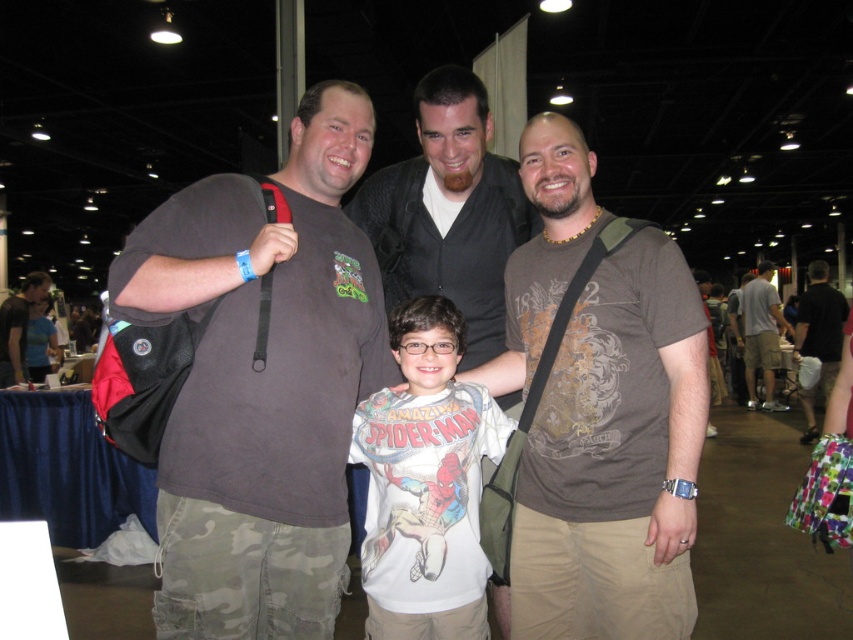
Question: Among these points, which one is nearest to the camera?

Choices:
 (A) click(x=9, y=348)
 (B) click(x=264, y=563)
 (C) click(x=368, y=612)

Answer: (B)

Question: Which object is positioned farthest from the dark brown leather jacket at center?

Choices:
 (A) brown cotton t-shirt at center
 (B) light brown cotton t-shirt at center
 (C) white cotton t-shirt at center
 (D) dark gray t-shirt at left

Answer: (B)

Question: Is dark gray t-shirt at left smaller than white cotton t-shirt at center?

Choices:
 (A) no
 (B) yes

Answer: (A)

Question: Among these points, which one is farthest from the camera?

Choices:
 (A) (770, 275)
 (B) (15, 365)

Answer: (A)

Question: Does brown cotton t-shirt at center have a smaller size compared to white cotton t-shirt at center?

Choices:
 (A) yes
 (B) no

Answer: (B)

Question: In this image, where is dark gray t-shirt at left located relative to light brown cotton t-shirt at center?

Choices:
 (A) above
 (B) below

Answer: (A)